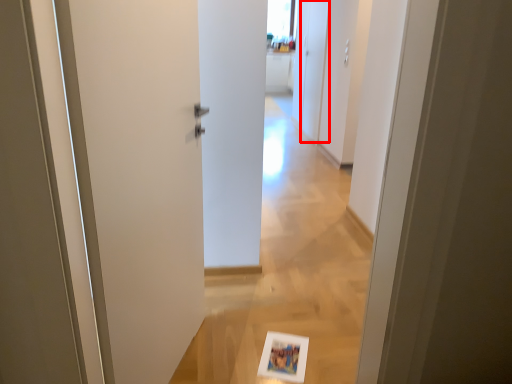
Question: From the image's perspective, what is the correct spatial relationship of screen door (annotated by the red box) in relation to door?

Choices:
 (A) below
 (B) above

Answer: (B)